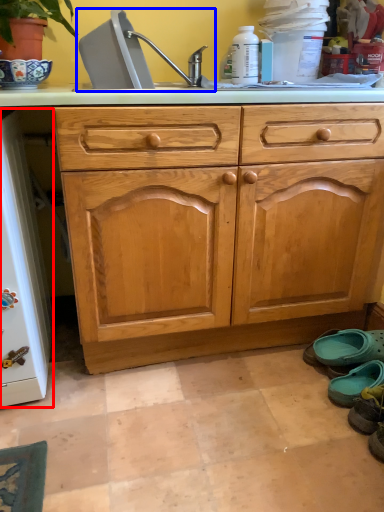
Question: Among these objects, which one is farthest to the camera, appliance (highlighted by a red box) or sink (highlighted by a blue box)?

Choices:
 (A) appliance
 (B) sink

Answer: (B)